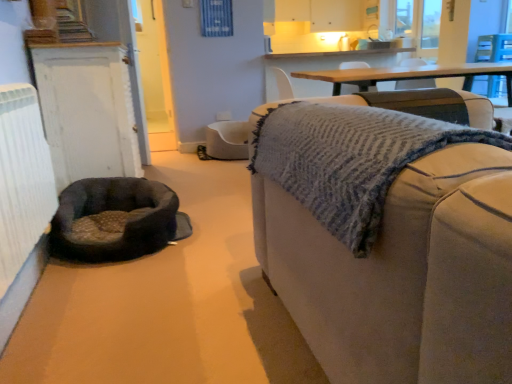
Question: Considering their positions, is white painted wood door at left located in front of or behind beige fabric couch at right?

Choices:
 (A) front
 (B) behind

Answer: (B)

Question: Is white painted wood door at left bigger or smaller than beige fabric couch at right?

Choices:
 (A) big
 (B) small

Answer: (B)

Question: Based on their relative distances, which object is farther from the beige fabric couch at right?

Choices:
 (A) white painted wood door at left
 (B) soft gray fabric dog bed at lower left
 (C) white textured radiator at left

Answer: (A)

Question: Which of these objects is positioned farthest from the white painted wood door at left?

Choices:
 (A) white textured radiator at left
 (B) beige fabric couch at right
 (C) soft gray fabric dog bed at lower left

Answer: (B)